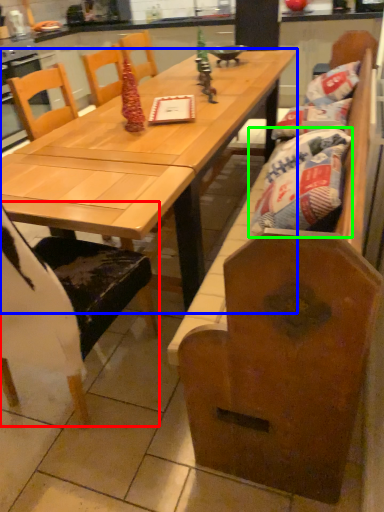
Question: Which object is the closest to the chair (highlighted by a red box)? Choose among these: table (highlighted by a blue box) or material (highlighted by a green box).

Choices:
 (A) table
 (B) material

Answer: (A)